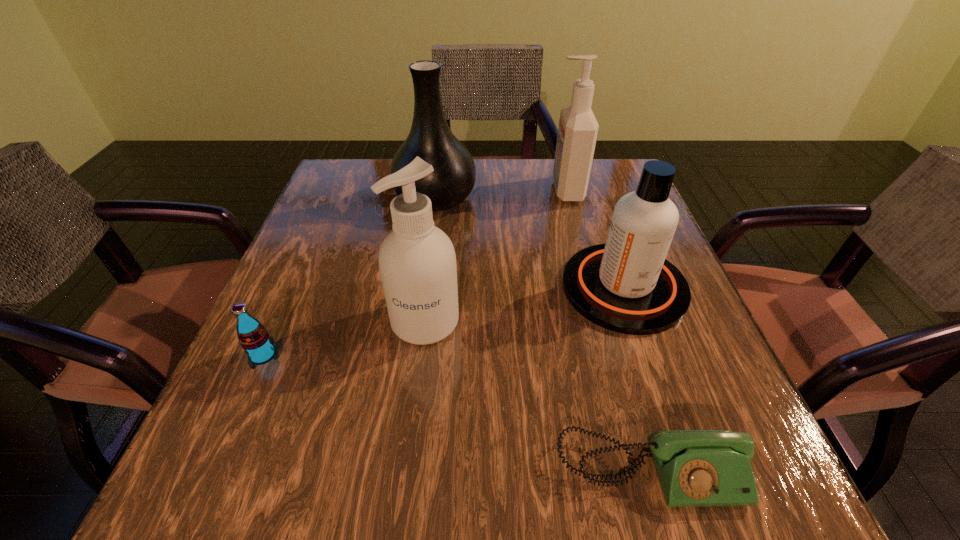
This screenshot has width=960, height=540. Find the location of `vacant space that satisfies the following two spatial constraints: 1. on the front label of the farthest cleansing agent; 2. on the front side of the soda`. vacant space that satisfies the following two spatial constraints: 1. on the front label of the farthest cleansing agent; 2. on the front side of the soda is located at coordinates (611, 355).

At what (x,y) coordinates should I click in order to perform the action: click on blank area in the image that satisfies the following two spatial constraints: 1. on the front label of the farthest cleansing agent; 2. on the front label of the leftmost cleansing agent. Please return your answer as a coordinate pair (x, y). Looking at the image, I should click on (601, 321).

Identify the location of vacant region that satisfies the following two spatial constraints: 1. on the front label of the farthest cleansing agent; 2. on the front label of the leftmost cleansing agent. The height and width of the screenshot is (540, 960). (601, 321).

Identify the location of free location that satisfies the following two spatial constraints: 1. on the front label of the shortest cleansing agent; 2. on the right side of the farthest cleansing agent. This screenshot has height=540, width=960. (592, 288).